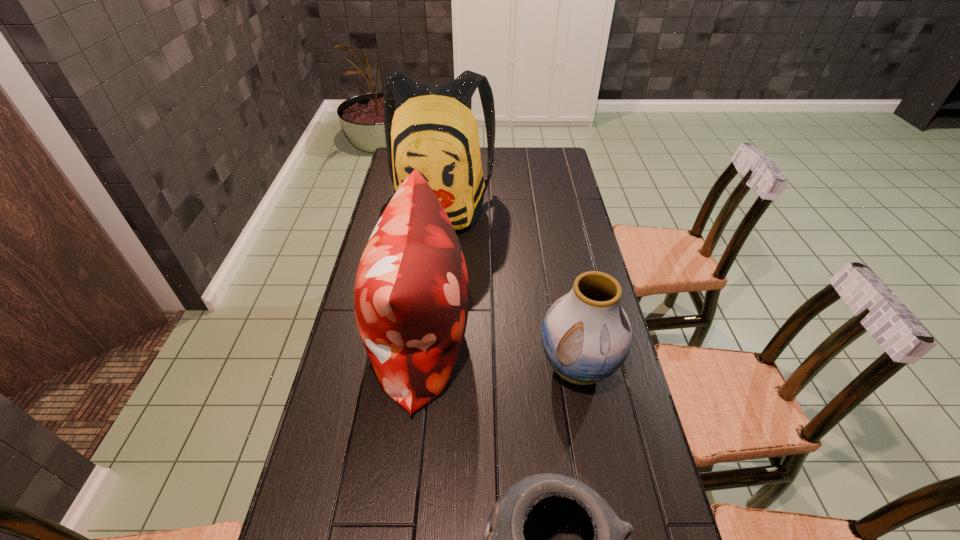
Locate an element on the screen. vacant space at the right edge is located at coordinates (540, 181).

At what (x,y) coordinates should I click in order to perform the action: click on empty location between the second shortest object and the cushion. Please return your answer as a coordinate pair (x, y). The height and width of the screenshot is (540, 960). Looking at the image, I should click on (499, 355).

I want to click on free space between the third shortest object and the second shortest object, so click(499, 355).

Identify the location of object that is the third closest to the urn. The height and width of the screenshot is (540, 960). (430, 128).

Where is `the closest object relative to the cushion`? the closest object relative to the cushion is located at coordinates (586, 335).

Where is `vacant area in the image that satisfies the following two spatial constraints: 1. on the front-facing side of the third tallest object; 2. on the left side of the second tallest object`? The width and height of the screenshot is (960, 540). vacant area in the image that satisfies the following two spatial constraints: 1. on the front-facing side of the third tallest object; 2. on the left side of the second tallest object is located at coordinates (419, 367).

The image size is (960, 540). Identify the location of vacant space that satisfies the following two spatial constraints: 1. on the front-facing side of the backpack; 2. on the front-facing side of the second tallest object. (426, 343).

This screenshot has height=540, width=960. What are the coordinates of `free location that satisfies the following two spatial constraints: 1. on the front-facing side of the second tallest object; 2. on the back side of the vase` in the screenshot? It's located at (419, 367).

Identify the location of vacant space that satisfies the following two spatial constraints: 1. on the front-facing side of the third tallest object; 2. on the right side of the backpack. (423, 367).

You are a GUI agent. You are given a task and a screenshot of the screen. Output one action in this format:
    pyautogui.click(x=<x>, y=<y>)
    Task: Click on the vacant space that satisfies the following two spatial constraints: 1. on the front-facing side of the second tallest object; 2. on the right side of the vase
    The width and height of the screenshot is (960, 540).
    Given the screenshot: What is the action you would take?
    pyautogui.click(x=419, y=367)